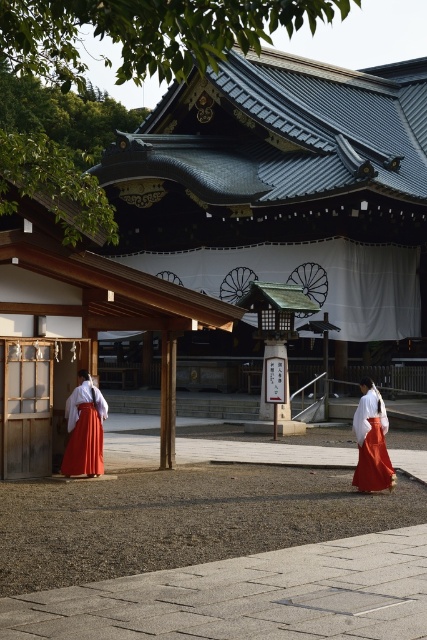
You are standing at the entrance of the shrine and see the point marked at coordinates (84, 429). What object is located at that point?

The point at coordinates (84, 429) indicates the location of the matte red skirt at left.

You are a visitor at the shrine and want to take a photo of the two people in traditional attire. The shrine has a rule that you must not step onto the gravel path. To frame your shot, you need to know which person is closer to you. Which person should you focus on to capture the matte white kimono at center and the matte red skirt at left in the best possible composition?

The matte white kimono at center is behind the matte red skirt at left, so focusing on the matte red skirt at left will ensure both subjects are in the frame with the matte white kimono at center slightly deeper in the scene, maintaining the shrine backdrop.

You are a photographer aiming to capture the two individuals in the scene. Since you want to ensure both the matte red skirt at left and the matte white kimono at center are clearly visible in your photo, which one should you focus on first to ensure depth of field?

You should focus on the matte red skirt at left first because it is taller than the matte white kimono at center, so focusing on the farther object ensures both will be in focus.